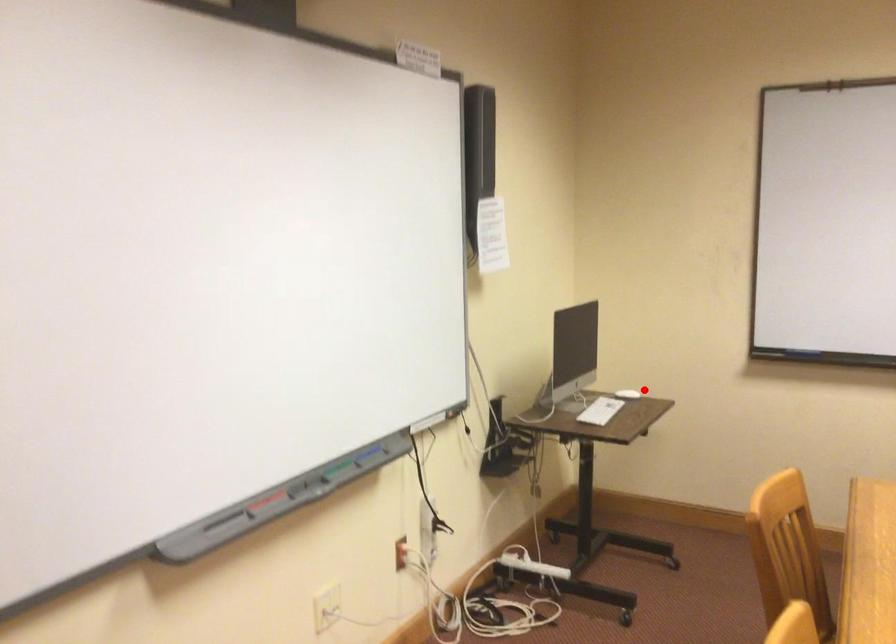
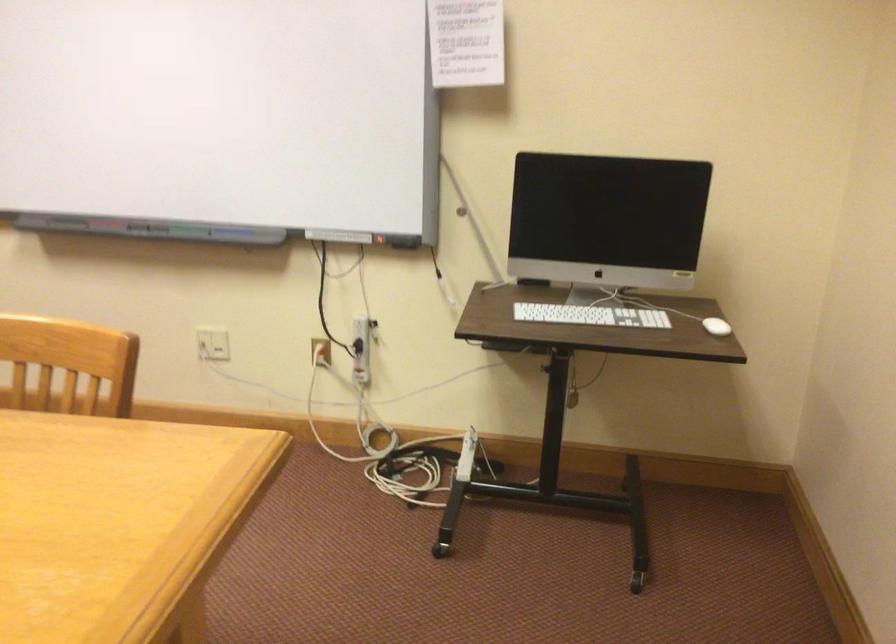
Find the pixel in the second image that matches the highlighted location in the first image.

(716, 326)